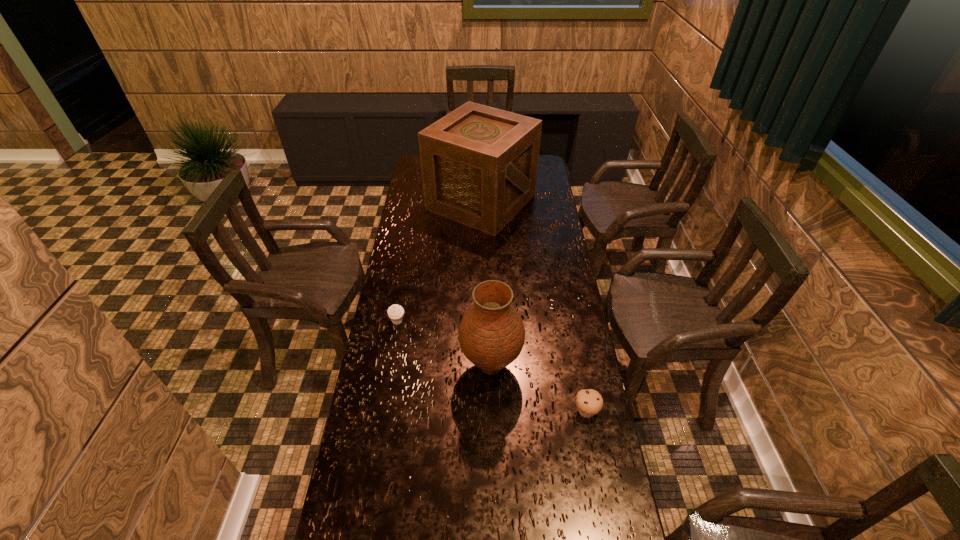
At what (x,y) coordinates should I click in order to perform the action: click on free space between the third farthest object and the right muffin. Please return your answer as a coordinate pair (x, y). The width and height of the screenshot is (960, 540). Looking at the image, I should click on (539, 389).

Identify the location of unoccupied position between the box and the nearer muffin. This screenshot has width=960, height=540. (534, 306).

Locate an element on the screen. vacant space that's between the farther muffin and the third farthest object is located at coordinates (444, 343).

I want to click on vacant space that is in between the farthest object and the rightmost object, so click(x=534, y=306).

In order to click on vacant space in between the vase and the nearest object in this screenshot , I will do `click(539, 389)`.

You are a GUI agent. You are given a task and a screenshot of the screen. Output one action in this format:
    pyautogui.click(x=<x>, y=<y>)
    Task: Click on the object that is the third closest to the left muffin
    This screenshot has width=960, height=540.
    Given the screenshot: What is the action you would take?
    pyautogui.click(x=589, y=402)

Identify the location of the closest object relative to the box. Image resolution: width=960 pixels, height=540 pixels. (395, 312).

Where is `free spot that satisfies the following two spatial constraints: 1. on the front side of the vase; 2. on the right side of the farther muffin`? This screenshot has width=960, height=540. free spot that satisfies the following two spatial constraints: 1. on the front side of the vase; 2. on the right side of the farther muffin is located at coordinates (390, 366).